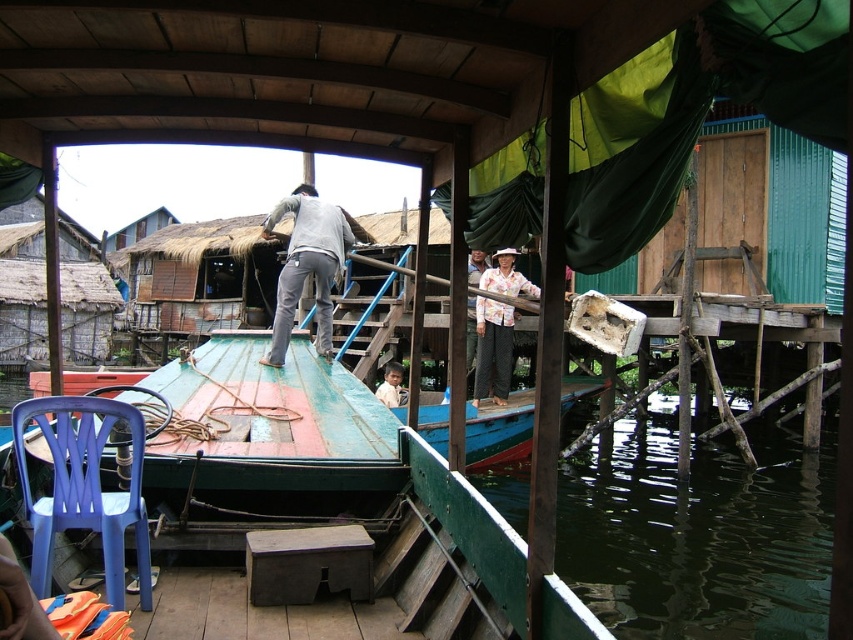
Question: Does blue plastic chair at lower left have a smaller size compared to white cotton shirt at center?

Choices:
 (A) yes
 (B) no

Answer: (B)

Question: Which of these objects is positioned closest to the floral fabric shirt at center?

Choices:
 (A) light brown wooden boat at center
 (B) white cotton shirt at center
 (C) dark green water at lower right

Answer: (B)

Question: Which of these objects is positioned farthest from the light brown wooden boat at center?

Choices:
 (A) floral fabric shirt at center
 (B) gray matte pants at center
 (C) dark green water at lower right
 (D) blue plastic chair at lower left

Answer: (D)

Question: Where is dark green water at lower right located in relation to light brown wooden boat at center in the image?

Choices:
 (A) right
 (B) left

Answer: (A)

Question: Is white cotton shirt at center thinner than light brown wooden boat at center?

Choices:
 (A) no
 (B) yes

Answer: (B)

Question: Which point appears closest to the camera in this image?

Choices:
 (A) (325, 349)
 (B) (16, 465)
 (C) (381, 385)

Answer: (B)